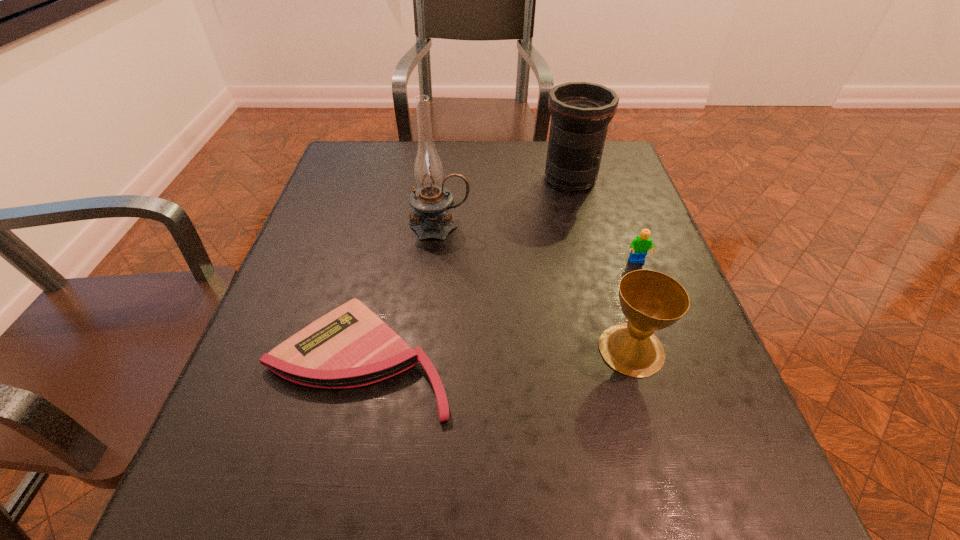
At what (x,y) coordinates should I click in order to perform the action: click on empty space between the oil lamp and the chalice. Please return your answer as a coordinate pair (x, y). The image size is (960, 540). Looking at the image, I should click on (536, 288).

Find the location of a particular element. The image size is (960, 540). unoccupied position between the wristlet and the chalice is located at coordinates (495, 355).

Find the location of a particular element. Image resolution: width=960 pixels, height=540 pixels. empty space between the third shortest object and the farthest object is located at coordinates (601, 264).

Select which object appears as the fourth closest to the third farthest object. Please provide its 2D coordinates. Your answer should be formatted as a tuple, i.e. [(x, y)], where the tuple contains the x and y coordinates of a point satisfying the conditions above.

[(350, 346)]

Locate which object ranks second in proximity to the third farthest object. Please provide its 2D coordinates. Your answer should be formatted as a tuple, i.e. [(x, y)], where the tuple contains the x and y coordinates of a point satisfying the conditions above.

[(580, 112)]

The height and width of the screenshot is (540, 960). In order to click on free spot that satisfies the following two spatial constraints: 1. on the back side of the wristlet; 2. on the right side of the chalice in this screenshot , I will do `click(362, 349)`.

Where is `free space that satisfies the following two spatial constraints: 1. on the back side of the farthest object; 2. on the right side of the wristlet`? This screenshot has height=540, width=960. free space that satisfies the following two spatial constraints: 1. on the back side of the farthest object; 2. on the right side of the wristlet is located at coordinates (401, 179).

At what (x,y) coordinates should I click in order to perform the action: click on vacant area in the image that satisfies the following two spatial constraints: 1. on the back side of the telephoto lens; 2. on the right side of the wristlet. Please return your answer as a coordinate pair (x, y). Image resolution: width=960 pixels, height=540 pixels. Looking at the image, I should click on (401, 179).